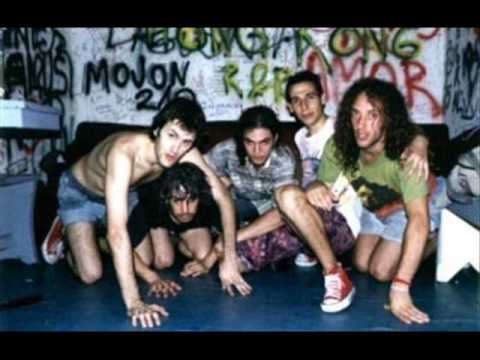
Image resolution: width=480 pixels, height=360 pixels. I want to click on blue floor, so click(280, 307).